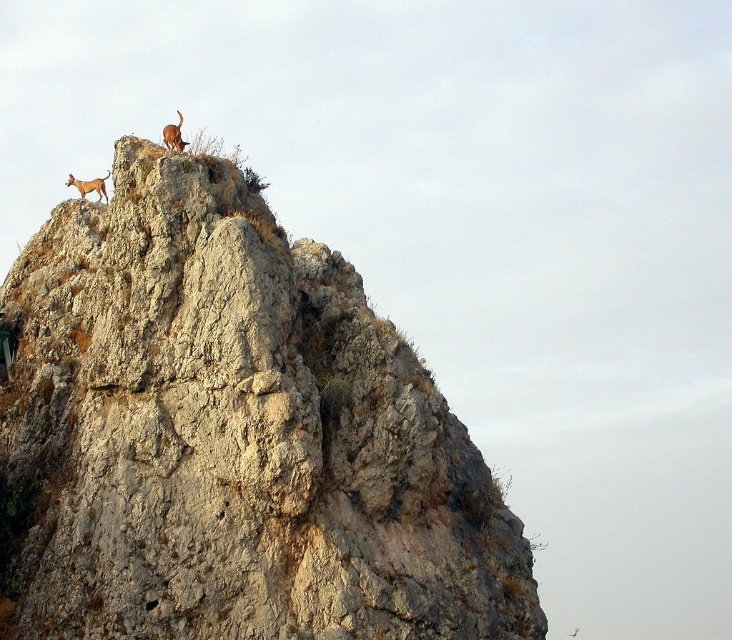
You are a hiker trying to navigate between two points marked on a map. The first point is at coordinate point(x=277, y=550) and the second point is at coordinate point(x=179, y=138). Which point is closer to your current position if you are standing at the base of the rocky outcrop?

Point(x=277, y=550) is closer to the viewer than point(x=179, y=138), so the first point is closer to your current position at the base of the rocky outcrop.

You are a hiker trying to navigate the rocky terrain. You need to place a marker on the rough textured rock at upper center. According to the coordinates provided, what are the exact coordinates where you should place the marker?

The rough textured rock at upper center should be marked at coordinates point (231,436).